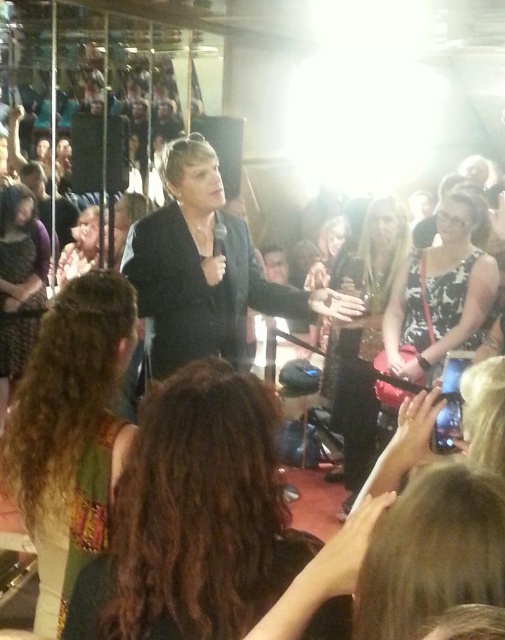
Question: Which of the following is the closest to the observer?

Choices:
 (A) (371, 262)
 (B) (182, 611)
 (C) (463, 204)

Answer: (B)

Question: Can you confirm if black matte suit at center is bigger than black textured dress at center?

Choices:
 (A) no
 (B) yes

Answer: (A)

Question: Based on their relative distances, which object is nearer to the floral dress at center?

Choices:
 (A) matte black jacket at left
 (B) matte black dress at left
 (C) brown curly hair at center

Answer: (C)

Question: Estimate the real-world distances between objects in this image. Which object is farther from the curly hair at center?

Choices:
 (A) black matte suit at center
 (B) brown curly hair at center

Answer: (A)

Question: Does black matte suit at center come in front of floral dress at center?

Choices:
 (A) no
 (B) yes

Answer: (B)

Question: Does curly hair at center appear under matte black jacket at left?

Choices:
 (A) no
 (B) yes

Answer: (B)